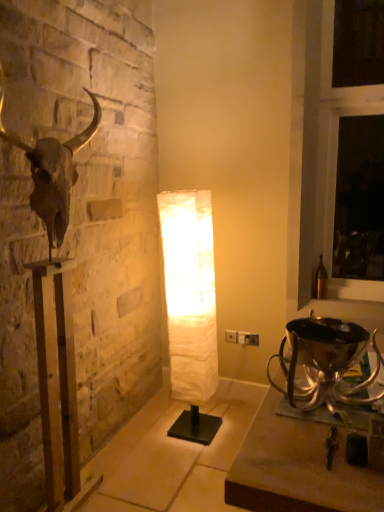
Question: Considering their positions, is metallic gold bull skull at left located in front of or behind shiny silver trophy at lower right?

Choices:
 (A) front
 (B) behind

Answer: (B)

Question: Is point (94, 126) closer or farther from the camera than point (352, 327)?

Choices:
 (A) closer
 (B) farther

Answer: (B)

Question: Based on their relative distances, which object is nearer to the shiny silver trophy at lower right?

Choices:
 (A) white marble lamp at center
 (B) white plastic electric outlet at center
 (C) white paper lamp at center
 (D) metallic gold bull skull at left

Answer: (C)

Question: Estimate the real-world distances between objects in this image. Which object is farther from the metallic gold bull skull at left?

Choices:
 (A) white plastic electric outlet at center
 (B) white marble lamp at center
 (C) white paper lamp at center
 (D) shiny silver trophy at lower right

Answer: (A)